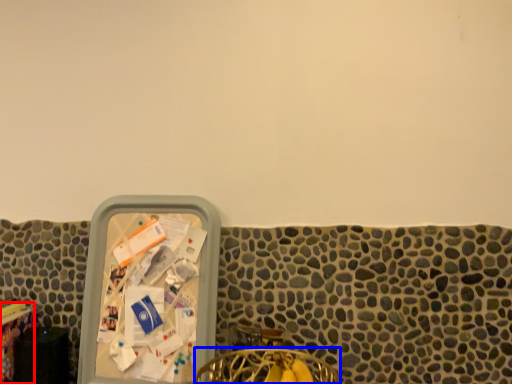
Question: Which object appears farthest to the camera in this image, table (highlighted by a red box) or chair (highlighted by a blue box)?

Choices:
 (A) table
 (B) chair

Answer: (A)